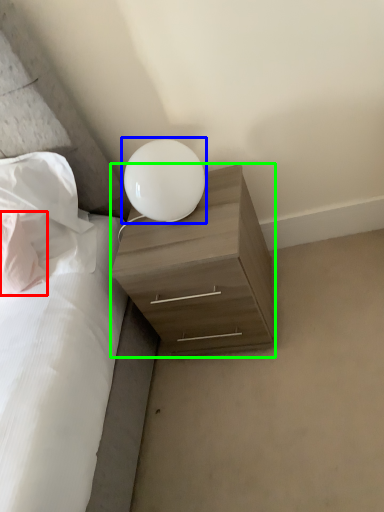
Question: Which object is the farthest from pillow (highlighted by a red box)? Choose among these: lamp (highlighted by a blue box) or nightstand (highlighted by a green box).

Choices:
 (A) lamp
 (B) nightstand

Answer: (B)